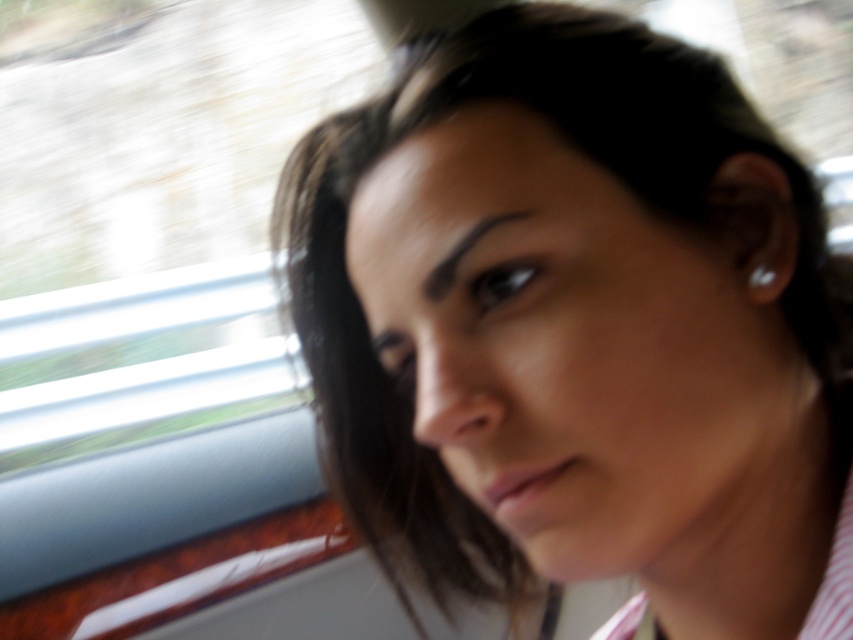
Question: Which of these objects is positioned farthest from the smooth skin face at center?

Choices:
 (A) black matte eyeliner at center
 (B) dark brown hair at upper center

Answer: (A)

Question: Which of the following is the closest to the observer?

Choices:
 (A) black matte eyeliner at center
 (B) white pearl earring at ear
 (C) smooth skin face at center

Answer: (C)

Question: Does smooth skin face at center appear on the left side of black matte eyeliner at center?

Choices:
 (A) yes
 (B) no

Answer: (B)

Question: Can you confirm if dark brown hair at upper center is wider than white pearl earring at ear?

Choices:
 (A) no
 (B) yes

Answer: (B)

Question: Can you confirm if dark brown hair at upper center is positioned to the right of black matte eyeliner at center?

Choices:
 (A) yes
 (B) no

Answer: (B)

Question: Which object appears farthest from the camera in this image?

Choices:
 (A) black matte eyeliner at center
 (B) white pearl earring at ear

Answer: (B)